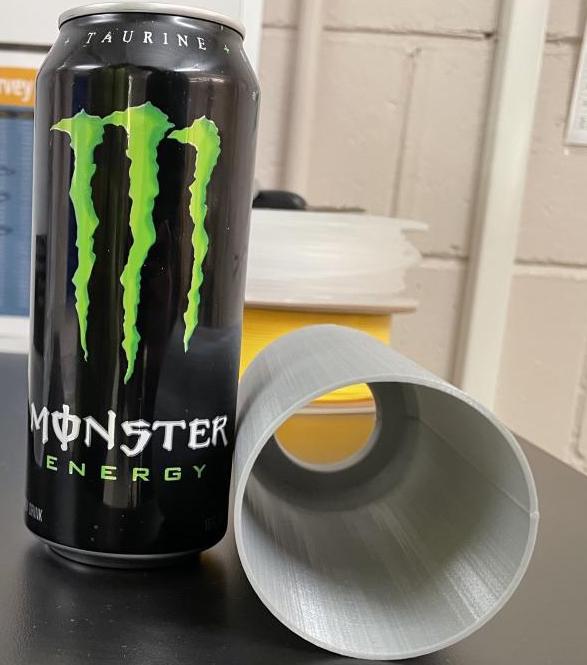
I want to click on white board, so click(x=26, y=11).